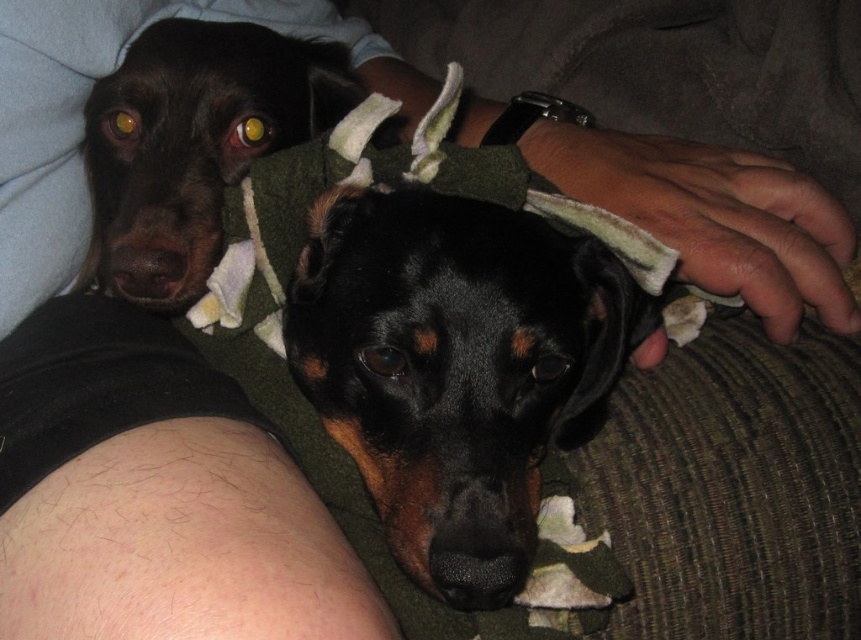
Can you confirm if black matte dog at center is smaller than shiny black dog at upper left?

Indeed, black matte dog at center has a smaller size compared to shiny black dog at upper left.

Looking at this image, is black matte dog at center in front of shiny black dog at upper left?

Yes, black matte dog at center is closer to the viewer.

Who is more distant from viewer, (493, 365) or (150, 273)?

Positioned behind is point (150, 273).

Locate an element on the screen. black matte dog at center is located at coordinates (456, 368).